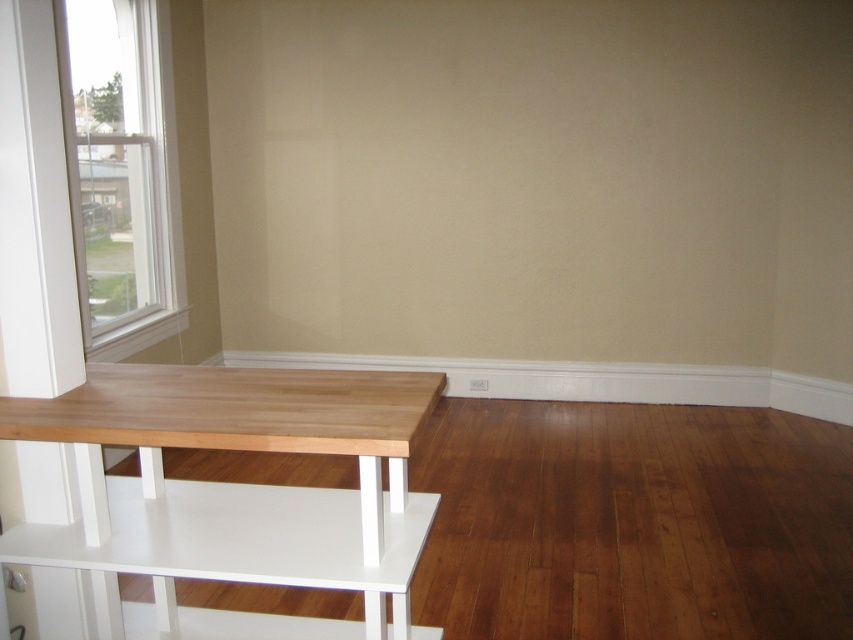
Question: Which of the following is the farthest from the observer?

Choices:
 (A) white plastic window at upper left
 (B) light wood table at left

Answer: (A)

Question: Where is light wood table at left located in relation to white plastic window at upper left in the image?

Choices:
 (A) right
 (B) left

Answer: (A)

Question: Does light wood table at left appear on the right side of white plastic window at upper left?

Choices:
 (A) no
 (B) yes

Answer: (B)

Question: Which of the following is the farthest from the observer?

Choices:
 (A) white plastic window at upper left
 (B) light wood table at left

Answer: (A)

Question: Can you confirm if light wood table at left is wider than white plastic window at upper left?

Choices:
 (A) yes
 (B) no

Answer: (A)